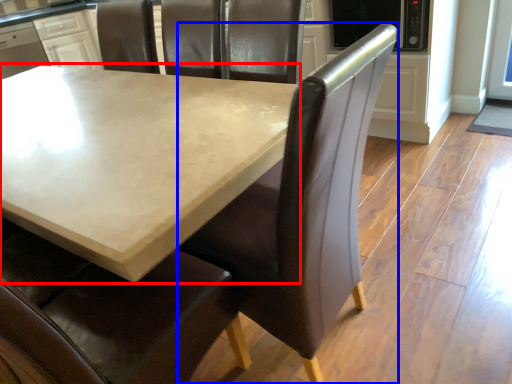
Question: Which object appears farthest to the camera in this image, table (highlighted by a red box) or chair (highlighted by a blue box)?

Choices:
 (A) table
 (B) chair

Answer: (B)